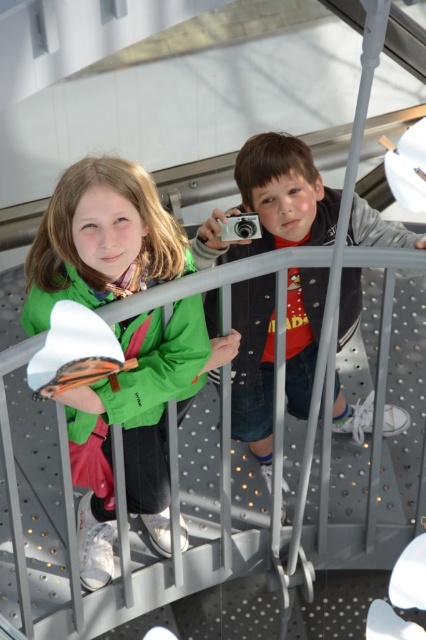
Question: Does white matte camera at center appear on the left side of green matte jacket at upper left?

Choices:
 (A) no
 (B) yes

Answer: (A)

Question: Which point appears farthest from the camera in this image?

Choices:
 (A) (310, 344)
 (B) (140, 378)
 (C) (250, 228)

Answer: (A)

Question: Where is green matte jacket at upper left located in relation to silver metallic camera at center in the image?

Choices:
 (A) right
 (B) left

Answer: (B)

Question: Which of the following is the closest to the observer?

Choices:
 (A) silver metallic camera at center
 (B) green matte jacket at upper left

Answer: (B)

Question: Is green matte jacket at left positioned before white matte camera at center?

Choices:
 (A) no
 (B) yes

Answer: (B)

Question: Based on their relative distances, which object is farther from the white matte camera at center?

Choices:
 (A) silver metallic camera at center
 (B) green matte jacket at upper left

Answer: (B)